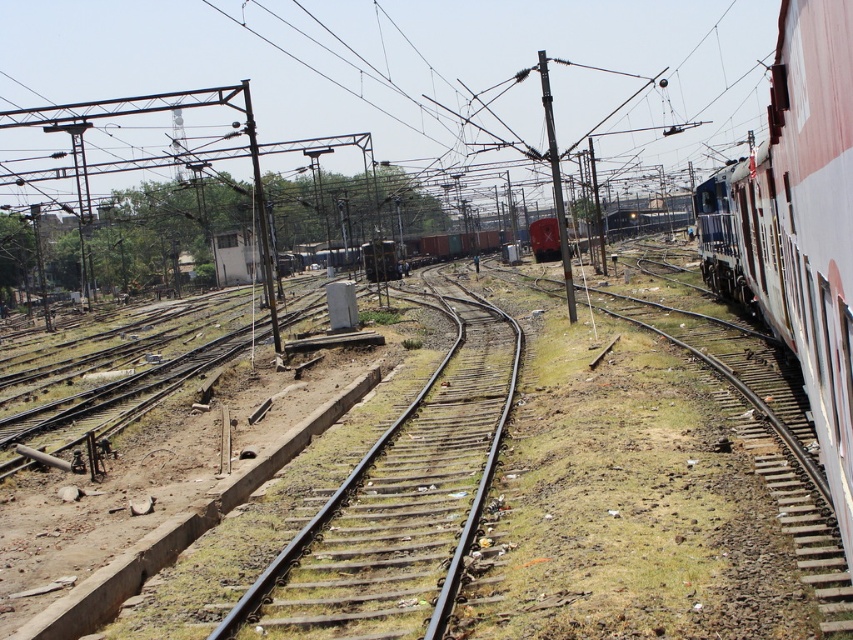
You are a railway inspector checking the track alignment. You notice the smooth metal train track at center and the white glossy train at right. Which object has a narrower width?

The smooth metal train track at center has a lesser width compared to the white glossy train at right, so the smooth metal train track at center is narrower.

You are a maintenance worker needing to reach the white glossy train at right from the smooth metal train track at center. The safety regulations state that the minimum safe distance between a worker and a moving train is 3 meters. Can you safely approach the train from the track?

The distance between the smooth metal train track at center and the white glossy train at right is 5.89 meters, which exceeds the 3 meter safety requirement. Therefore, it is safe to approach the train from the track as long as the train is stationary. However, if the train is moving, additional safety precautions must be followed beyond just distance.

You are a maintenance worker standing at the center of the railway yard. You need to inspect the smooth metal train track at center. According to the coordinates provided, where exactly should you go to find it?

The smooth metal train track at center is located at point (399, 504), so you should go to that coordinate to inspect it.